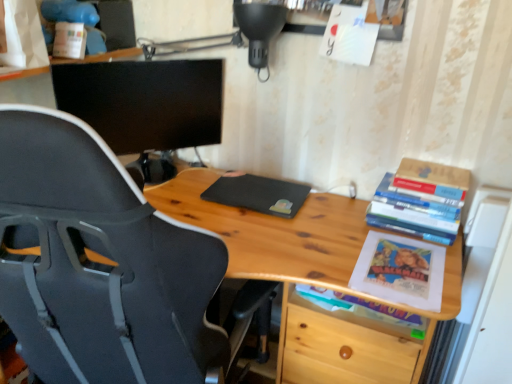
Question: Considering the positions of point (448, 240) and point (131, 119), is point (448, 240) closer or farther from the camera than point (131, 119)?

Choices:
 (A) farther
 (B) closer

Answer: (B)

Question: From a real-world perspective, is hardcover books at right, which appears as the 2th book when viewed from the top, positioned above or below black matte monitor at upper left?

Choices:
 (A) below
 (B) above

Answer: (A)

Question: Which object is positioned closest to the black matte laptop at center?

Choices:
 (A) hardcover books at right, which appears as the 2th book when viewed from the top
 (B) wooden table at right
 (C) black matte monitor at upper left
 (D) matte paper book at lower right, the first book from the bottom
 (E) black plastic chair at left

Answer: (B)

Question: Based on their relative distances, which object is nearer to the hardcover book at upper right, acting as the 1th book starting from the top?

Choices:
 (A) hardcover books at right, which appears as the second book when ordered from the bottom
 (B) wooden table at right
 (C) black plastic chair at left
 (D) black matte monitor at upper left
 (E) matte paper book at lower right, the third book viewed from the top

Answer: (A)